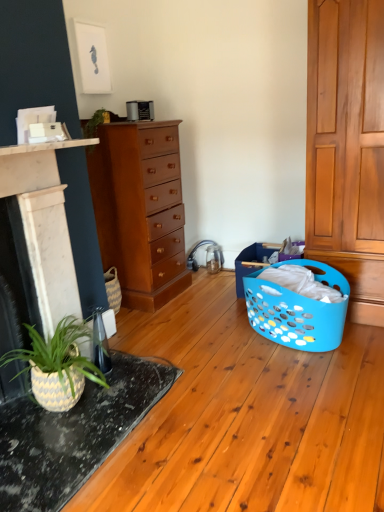
Question: Looking at the image, does mahogany wood chest of drawers at center seem bigger or smaller compared to white marble fireplace at left?

Choices:
 (A) small
 (B) big

Answer: (B)

Question: Considering the positions of point (170, 269) and point (41, 288), is point (170, 269) closer or farther from the camera than point (41, 288)?

Choices:
 (A) farther
 (B) closer

Answer: (A)

Question: Estimate the real-world distances between objects in this image. Which object is farther from the mahogany wood chest of drawers at center?

Choices:
 (A) speckled ceramic table at lower left
 (B) blue plastic laundry basket at lower right
 (C) white marble fireplace at left

Answer: (A)

Question: Which object is the closest to the white marble fireplace at left?

Choices:
 (A) speckled ceramic table at lower left
 (B) blue plastic laundry basket at lower right
 (C) mahogany wood chest of drawers at center

Answer: (A)